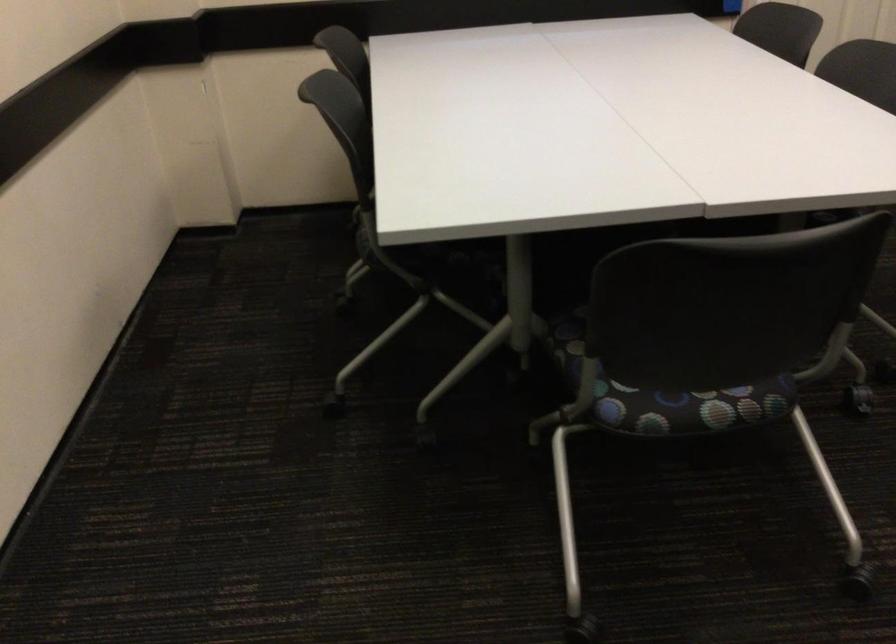
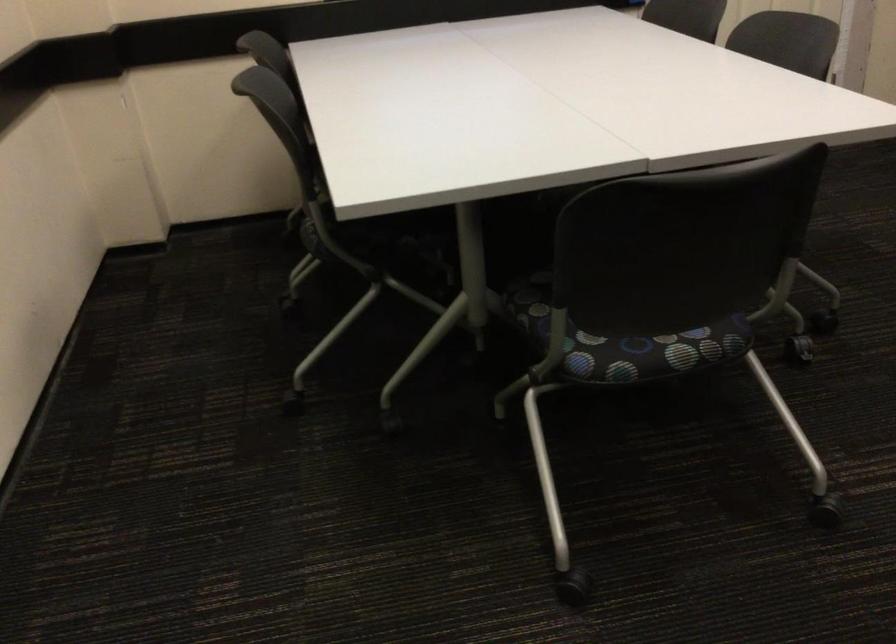
Question: Which direction would the cameraman need to move to produce the second image? Reply with the corresponding letter.

Choices:
 (A) Left
 (B) Right
 (C) Forward
 (D) Backward

Answer: (A)